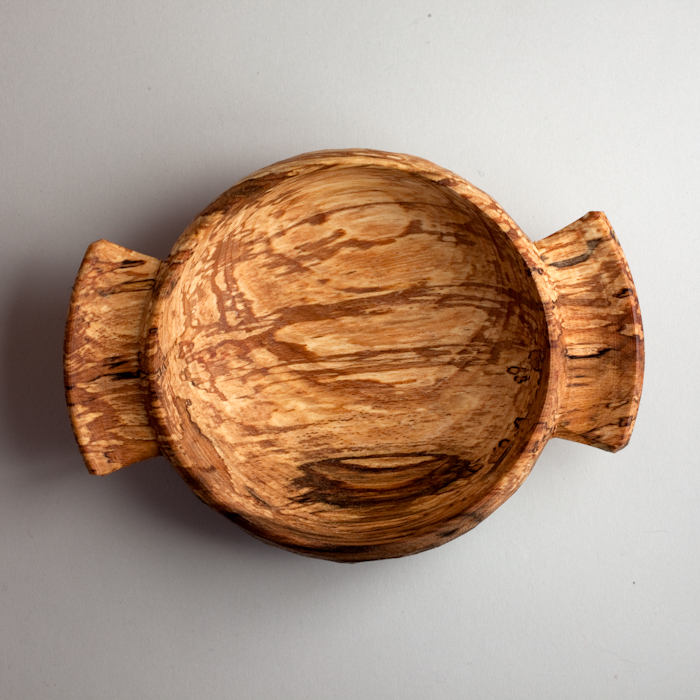
Where is `table`? table is located at coordinates (187, 591).